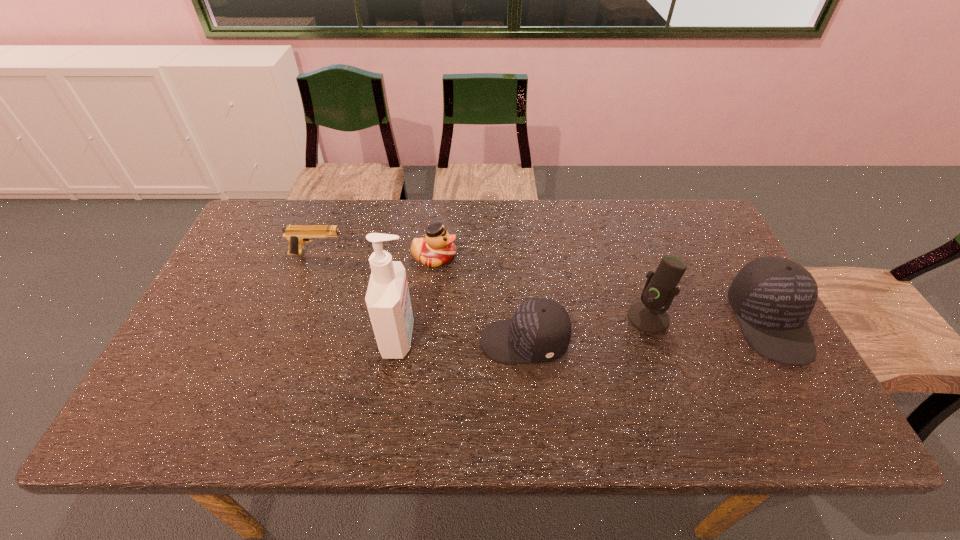
In the current image, all baseball caps are evenly spaced. To maintain this equal spacing, where should an additional baseball cap be placed on the left? Please point out a free spot. Please provide its 2D coordinates. Your answer should be formatted as a tuple, i.e. [(x, y)], where the tuple contains the x and y coordinates of a point satisfying the conditions above.

[(259, 363)]